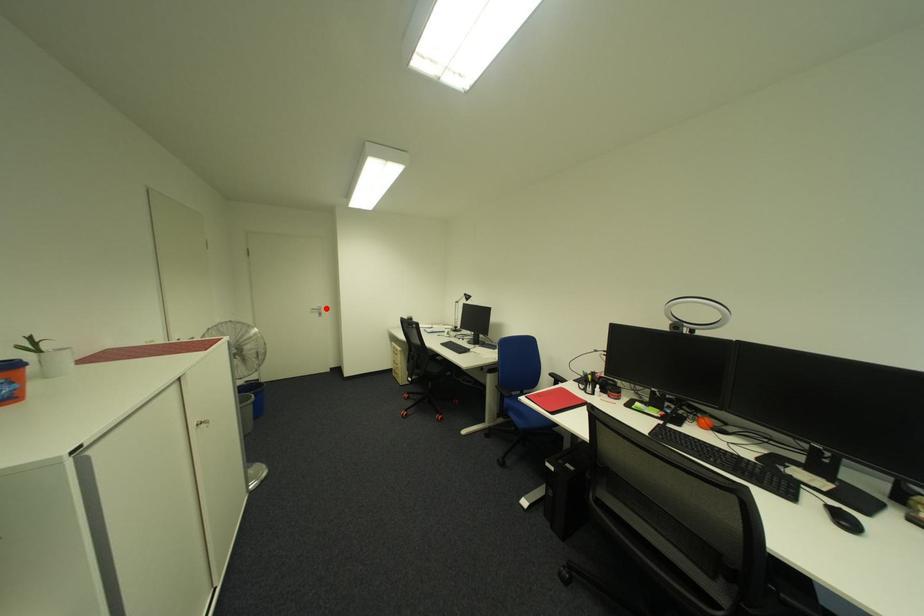
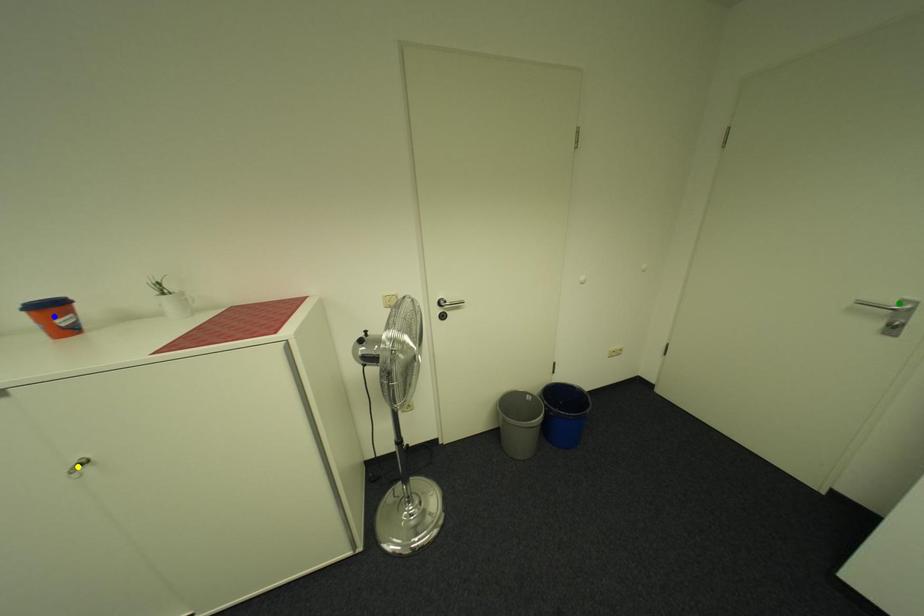
Question: I am providing you with two images of the same scene from different viewpoints. A red point is marked on the first image. You are given multiple points on the second image. Can you choose the point in image 2 that corresponds to the point in image 1?

Choices:
 (A) blue point
 (B) yellow point
 (C) green point

Answer: (C)